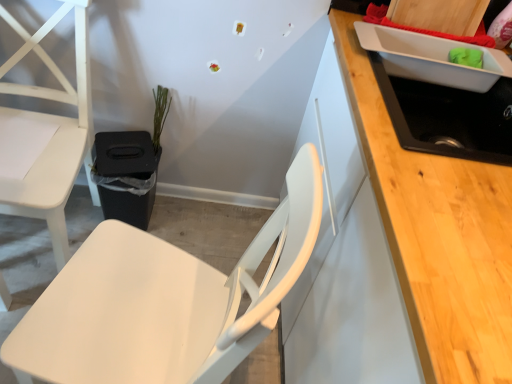
Question: From the image's perspective, is green matte plant at center over black matte sink at upper right?

Choices:
 (A) yes
 (B) no

Answer: (A)

Question: From a real-world perspective, does green matte plant at center sit lower than black matte sink at upper right?

Choices:
 (A) yes
 (B) no

Answer: (A)

Question: Is green matte plant at center facing away from black matte sink at upper right?

Choices:
 (A) no
 (B) yes

Answer: (A)

Question: From the image's perspective, is green matte plant at center under black matte sink at upper right?

Choices:
 (A) yes
 (B) no

Answer: (B)

Question: Considering the relative positions of green matte plant at center and black matte sink at upper right in the image provided, is green matte plant at center behind black matte sink at upper right?

Choices:
 (A) yes
 (B) no

Answer: (A)

Question: Is point (105, 281) positioned closer to the camera than point (501, 105)?

Choices:
 (A) closer
 (B) farther

Answer: (A)

Question: Considering the relative positions of matte white chair at center, acting as the 2th chair starting from the left, and black matte sink at upper right in the image provided, is matte white chair at center, acting as the 2th chair starting from the left, to the left or to the right of black matte sink at upper right?

Choices:
 (A) right
 (B) left

Answer: (B)

Question: In terms of height, does matte white chair at center, acting as the 2th chair starting from the left, look taller or shorter compared to black matte sink at upper right?

Choices:
 (A) short
 (B) tall

Answer: (B)

Question: From a real-world perspective, relative to black matte sink at upper right, is matte white chair at center, which is counted as the 1th chair, starting from the right, vertically above or below?

Choices:
 (A) above
 (B) below

Answer: (B)

Question: Is point (501, 117) positioned closer to the camera than point (122, 281)?

Choices:
 (A) farther
 (B) closer

Answer: (A)

Question: Considering the positions of black matte sink at upper right and matte white chair at center, which is counted as the 1th chair, starting from the right, in the image, is black matte sink at upper right taller or shorter than matte white chair at center, which is counted as the 1th chair, starting from the right,?

Choices:
 (A) tall
 (B) short

Answer: (B)

Question: Is black matte sink at upper right inside the boundaries of matte white chair at center, which is counted as the 1th chair, starting from the right, or outside?

Choices:
 (A) inside
 (B) outside

Answer: (B)

Question: From the image's perspective, is black matte sink at upper right above or below matte white chair at center, which is counted as the 1th chair, starting from the right?

Choices:
 (A) below
 (B) above

Answer: (B)

Question: In the image, is white matte chair at left, the second chair positioned from the right, on the left side or the right side of matte white chair at center, acting as the 2th chair starting from the left?

Choices:
 (A) left
 (B) right

Answer: (A)

Question: Is point (84, 61) closer or farther from the camera than point (258, 307)?

Choices:
 (A) closer
 (B) farther

Answer: (B)